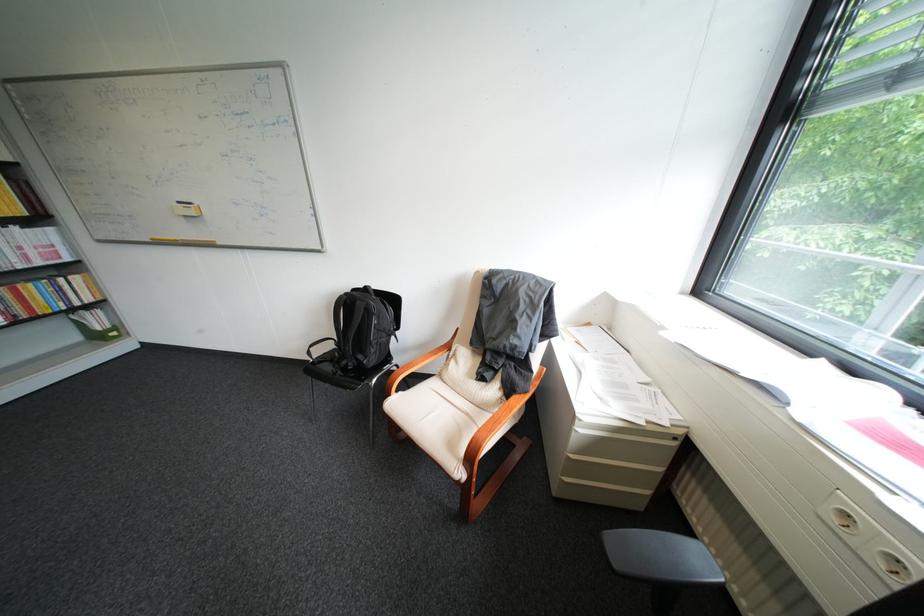
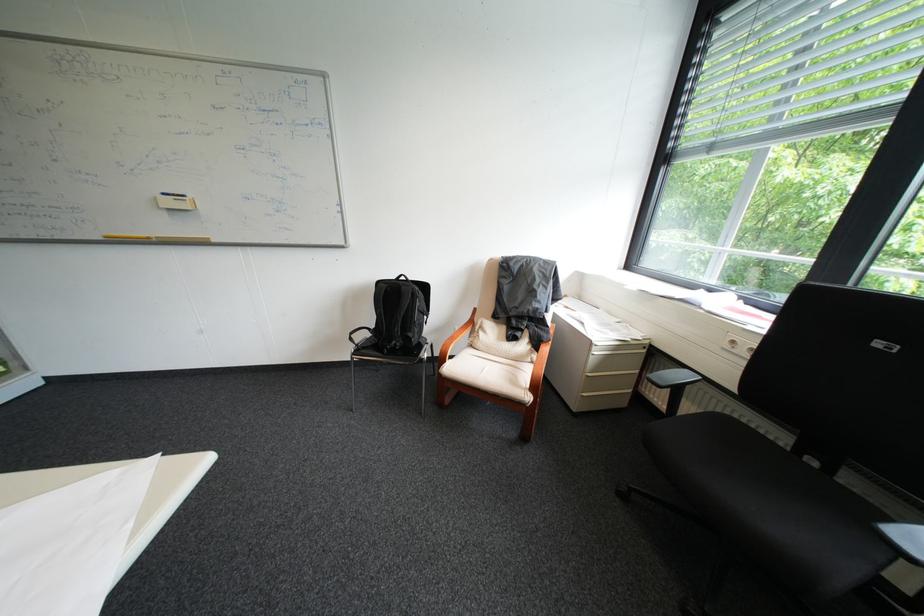
Where in the second image is the point corresponding to (x=402, y=395) from the first image?

(456, 363)